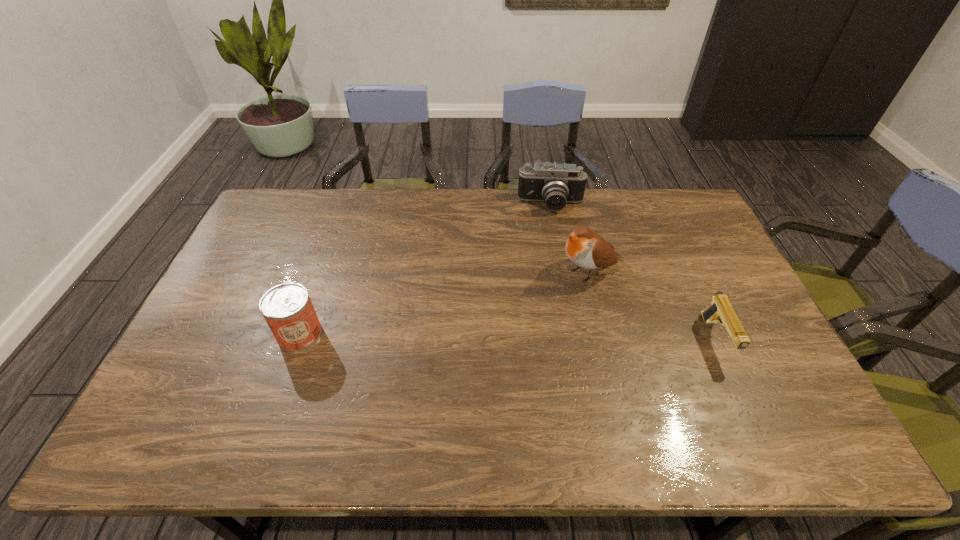
The width and height of the screenshot is (960, 540). I want to click on vacant space on the desktop that is between the can and the rightmost object and is positioned on the front-facing side of the camera, so point(561,338).

Where is `free space on the desktop that is between the can and the shortest object and is positioned at the face of the third nearest object`? The height and width of the screenshot is (540, 960). free space on the desktop that is between the can and the shortest object and is positioned at the face of the third nearest object is located at coordinates (457, 336).